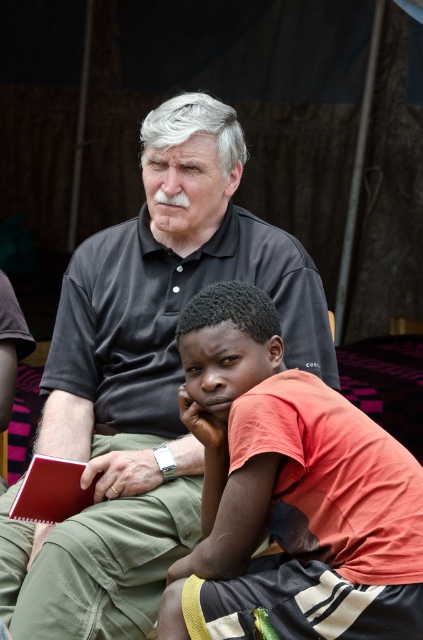
Does black matte shirt at center lie in front of orange cotton shirt at center?

No, it is not.

Is point (139, 628) closer to viewer compared to point (382, 534)?

No, it is behind (382, 534).

Find the location of `black matte shirt at center`. black matte shirt at center is located at coordinates (145, 380).